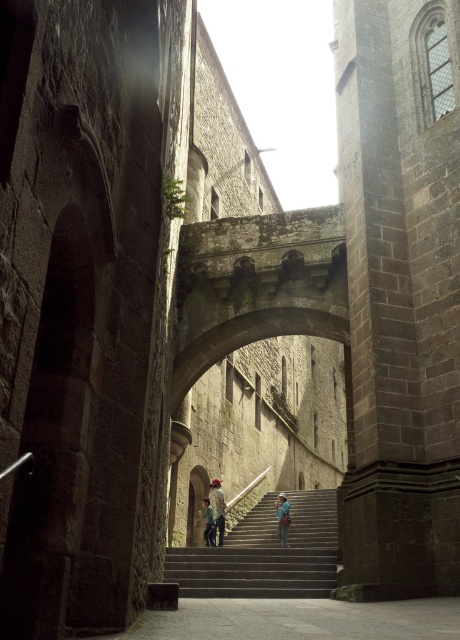
Question: Does blue denim jeans at center have a smaller size compared to green fabric child at center?

Choices:
 (A) yes
 (B) no

Answer: (A)

Question: Which object appears farthest from the camera in this image?

Choices:
 (A) blue denim jeans at center
 (B) green fabric child at center
 (C) light blue denim jeans at center
 (D) stone textured stairs at center

Answer: (A)

Question: Which point is farther to the camera?

Choices:
 (A) blue denim jeans at center
 (B) green fabric child at center
 (C) stone textured stairs at center
 (D) light blue denim jeans at center

Answer: (A)

Question: Considering the relative positions of stone textured stairs at center and light blue denim jeans at center in the image provided, where is stone textured stairs at center located with respect to light blue denim jeans at center?

Choices:
 (A) below
 (B) above

Answer: (A)

Question: Where is light blue denim jeans at center located in relation to blue denim jeans at center in the image?

Choices:
 (A) left
 (B) right

Answer: (A)

Question: Which of the following is the farthest from the observer?

Choices:
 (A) stone textured stairs at center
 (B) light blue denim jeans at center

Answer: (B)